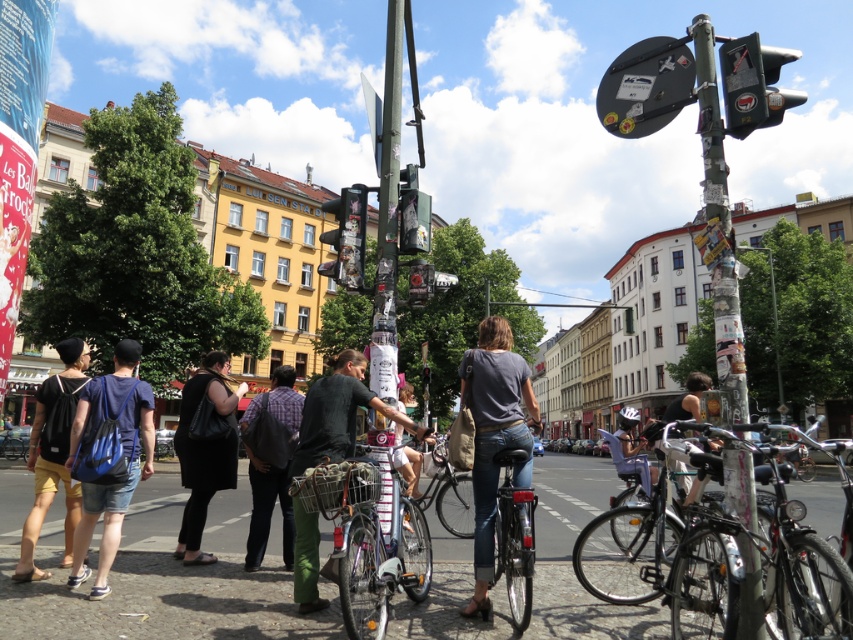
You are standing at point (627,83) and want to walk to point (614,496). Given that there are no obstacles between them, can you directly walk in a straight line to your destination?

Point (614,496) is behind point (627,83), so yes, you can walk directly in a straight line to your destination since there are no obstacles mentioned between them.